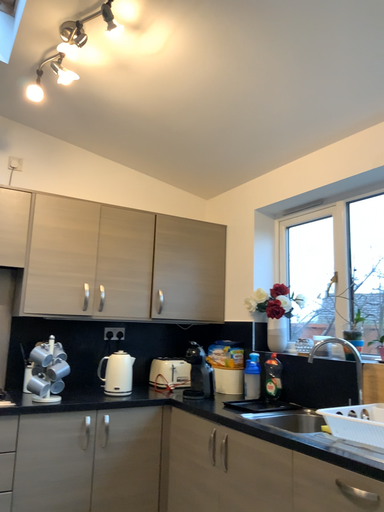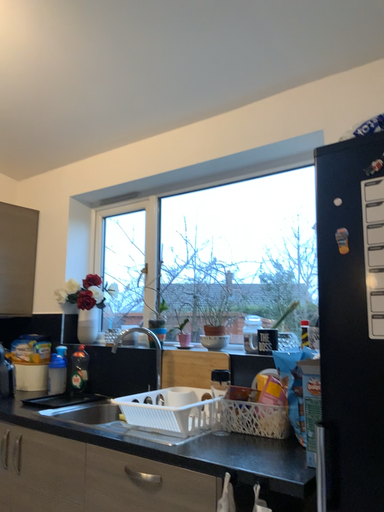
Question: How did the camera likely rotate when shooting the video?

Choices:
 (A) rotated right
 (B) rotated left

Answer: (A)